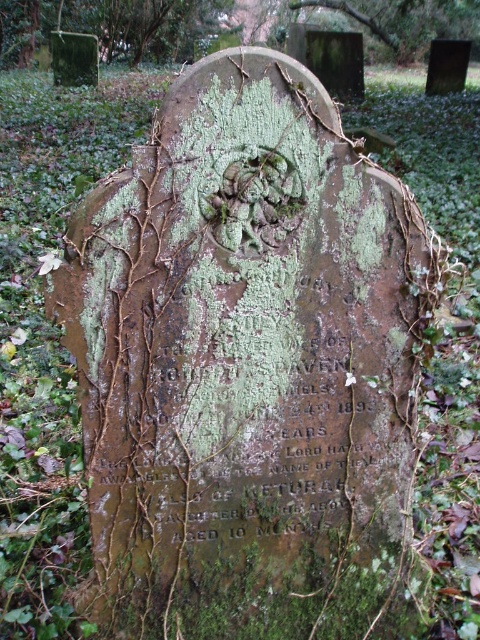
Question: Can you confirm if green mossy tree at upper center is smaller than green mossy gravestone at upper center?

Choices:
 (A) yes
 (B) no

Answer: (B)

Question: Among these points, which one is nearest to the camera?

Choices:
 (A) (361, 13)
 (B) (137, 10)

Answer: (A)

Question: Does green mossy tree at upper center appear under green mossy gravestone at upper center?

Choices:
 (A) no
 (B) yes

Answer: (A)

Question: Is green mossy tree at upper center to the left of green mossy gravestone at upper center from the viewer's perspective?

Choices:
 (A) no
 (B) yes

Answer: (B)

Question: Among these objects, which one is nearest to the camera?

Choices:
 (A) green mossy gravestone at upper center
 (B) green mossy tree at upper center

Answer: (A)

Question: Which object appears farthest from the camera in this image?

Choices:
 (A) green mossy gravestone at upper center
 (B) green mossy tree at upper center

Answer: (B)